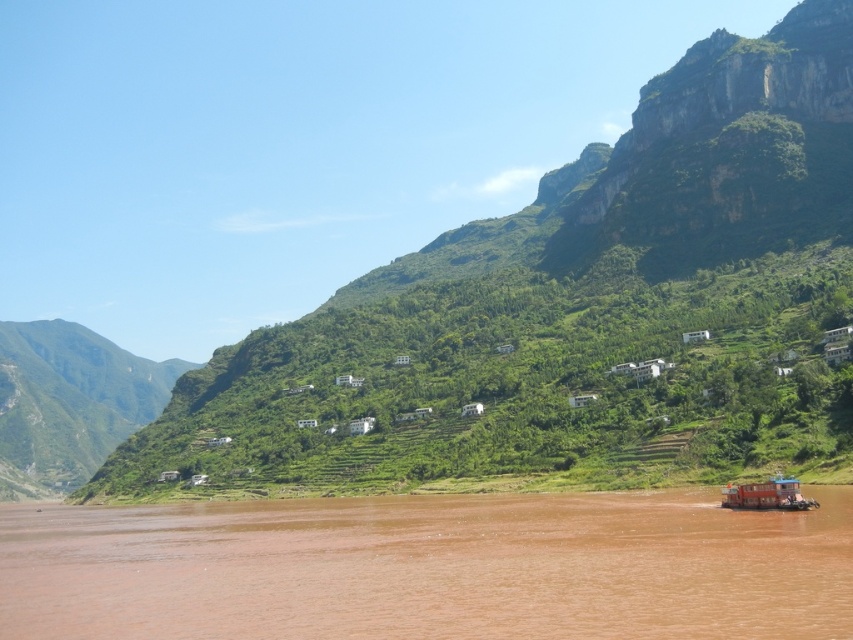
Question: Does brown muddy water at lower right have a lesser width compared to green grassy hillside at left?

Choices:
 (A) yes
 (B) no

Answer: (A)

Question: Which point is closer to the camera taking this photo?

Choices:
 (A) (787, 481)
 (B) (71, 602)

Answer: (B)

Question: Estimate the real-world distances between objects in this image. Which object is farther from the brown muddy water at lower right?

Choices:
 (A) orange plastic boat at lower right
 (B) green grassy hillside at left

Answer: (B)

Question: Estimate the real-world distances between objects in this image. Which object is closer to the orange plastic boat at lower right?

Choices:
 (A) brown muddy water at lower right
 (B) green grassy hillside at left

Answer: (A)

Question: In this image, where is brown muddy water at lower right located relative to orange plastic boat at lower right?

Choices:
 (A) right
 (B) left

Answer: (B)

Question: Does brown muddy water at lower right appear on the right side of orange plastic boat at lower right?

Choices:
 (A) no
 (B) yes

Answer: (A)